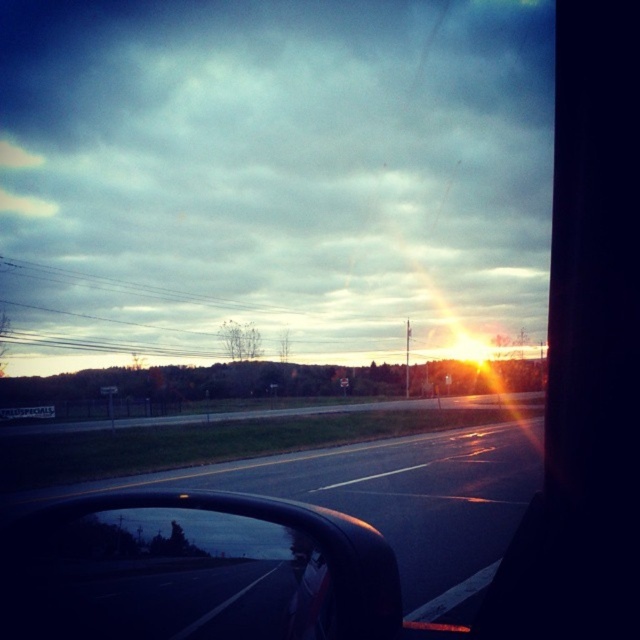
From the picture: You are a passenger in the car and want to see the road ahead clearly. Which object, the black glossy rearview mirror at lower left or the black asphalt highway at center, is positioned closer to you?

The black glossy rearview mirror at lower left is closer to you because it is behind the black asphalt highway at center, meaning it is nearer to your position inside the car.

You are a passenger in a car and want to look at the black asphalt highway at center through the black glossy rearview mirror at lower left. Can you see the highway reflected in the mirror?

The black asphalt highway at center is positioned on the right side of the black glossy rearview mirror at lower left, so the mirror is facing towards the highway. Therefore, the passenger can see the highway reflected in the mirror.

You are driving a car and want to know if the black asphalt highway at center is wider than the black glossy rearview mirror at lower left. Can you confirm this?

The black asphalt highway at center is wider than the black glossy rearview mirror at lower left, so yes, the highway is wider than the mirror.